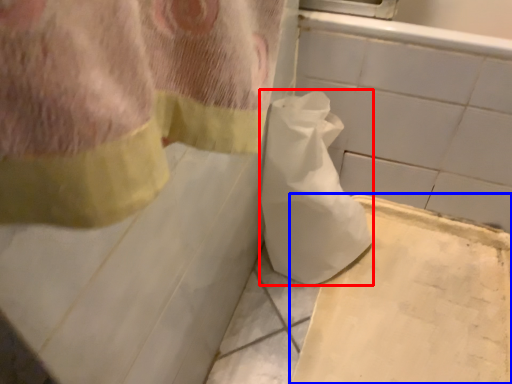
Question: Which point is closer to the camera, toilet paper (highlighted by a red box) or cardboard (highlighted by a blue box)?

Choices:
 (A) toilet paper
 (B) cardboard

Answer: (A)